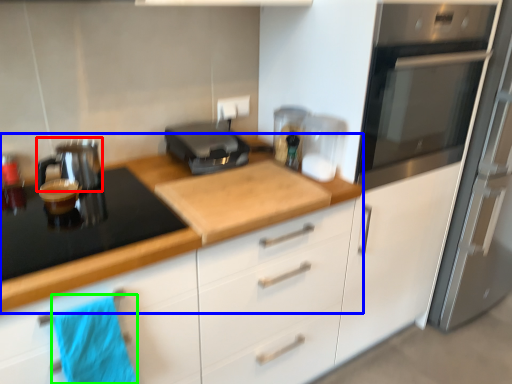
Question: Which object is the farthest from kitchen appliance (highlighted by a red box)? Choose among these: countertop (highlighted by a blue box) or beach towel (highlighted by a green box).

Choices:
 (A) countertop
 (B) beach towel

Answer: (B)